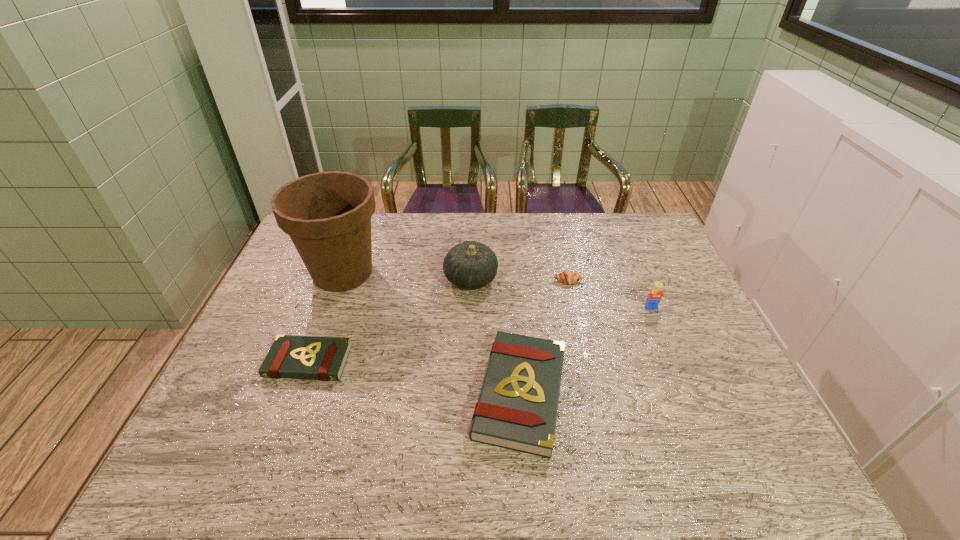
Where is `free space between the gourd and the Lego`? This screenshot has height=540, width=960. free space between the gourd and the Lego is located at coordinates (562, 294).

Where is `blank region between the second tallest object and the taller book`? The width and height of the screenshot is (960, 540). blank region between the second tallest object and the taller book is located at coordinates (495, 336).

Where is `free spot between the tallest object and the shorter book`? free spot between the tallest object and the shorter book is located at coordinates (325, 317).

The height and width of the screenshot is (540, 960). In order to click on vacant space that's between the fourth tallest object and the shorter book in this screenshot , I will do `click(415, 377)`.

The height and width of the screenshot is (540, 960). What are the coordinates of `free area in between the shorter book and the flowerpot` in the screenshot? It's located at (325, 317).

You are a GUI agent. You are given a task and a screenshot of the screen. Output one action in this format:
    pyautogui.click(x=<x>, y=<y>)
    Task: Click on the free point between the gourd and the second object from right to left
    This screenshot has width=960, height=540.
    Given the screenshot: What is the action you would take?
    pyautogui.click(x=519, y=280)

At what (x,y) coordinates should I click in order to perform the action: click on free point between the tallest object and the rightmost object. Please return your answer as a coordinate pair (x, y). This screenshot has width=960, height=540. Looking at the image, I should click on (497, 291).

I want to click on the third closest object to the pastry, so click(x=517, y=409).

Identify which object is located as the second nearest to the fifth shortest object. Please provide its 2D coordinates. Your answer should be formatted as a tuple, i.e. [(x, y)], where the tuple contains the x and y coordinates of a point satisfying the conditions above.

[(567, 277)]

What are the coordinates of `free location that satisfies the following two spatial constraints: 1. on the back side of the left book; 2. on the right side of the gourd` in the screenshot? It's located at (339, 279).